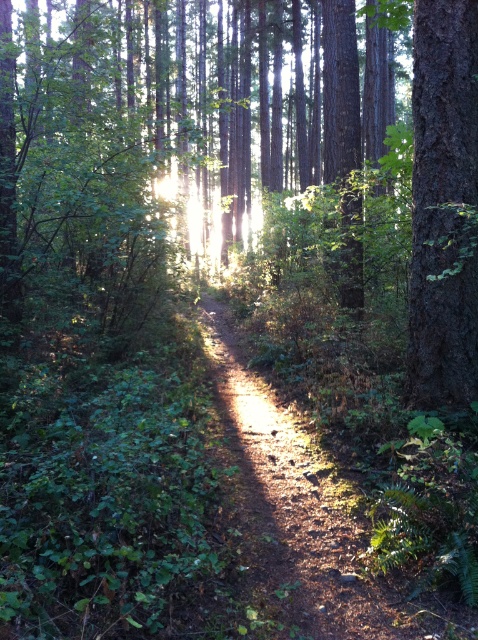
Based on the photo, can you confirm if brown textured tree at center is positioned below smooth bark tree at right?

No, brown textured tree at center is not below smooth bark tree at right.

Does point (319, 129) lie behind point (438, 257)?

Yes, it is behind point (438, 257).

This screenshot has width=478, height=640. I want to click on brown textured tree at center, so click(x=245, y=138).

At what (x,y) coordinates should I click in order to perform the action: click on brown textured tree at center. Please return your answer as a coordinate pair (x, y). This screenshot has width=478, height=640. Looking at the image, I should click on 245,138.

Who is taller, dirt path at center or smooth bark tree at right?

Standing taller between the two is smooth bark tree at right.

Which is more to the right, dirt path at center or smooth bark tree at right?

smooth bark tree at right is more to the right.

The height and width of the screenshot is (640, 478). What do you see at coordinates (314, 513) in the screenshot?
I see `dirt path at center` at bounding box center [314, 513].

Identify the location of dirt path at center. (314, 513).

Is brown textured tree at center below dirt path at center?

Incorrect, brown textured tree at center is not positioned below dirt path at center.

Is point (444, 198) farther from viewer compared to point (198, 316)?

No, (444, 198) is in front of (198, 316).

This screenshot has width=478, height=640. Find the location of `brown textured tree at center`. brown textured tree at center is located at coordinates (245, 138).

This screenshot has width=478, height=640. Identify the location of brown textured tree at center. (245, 138).